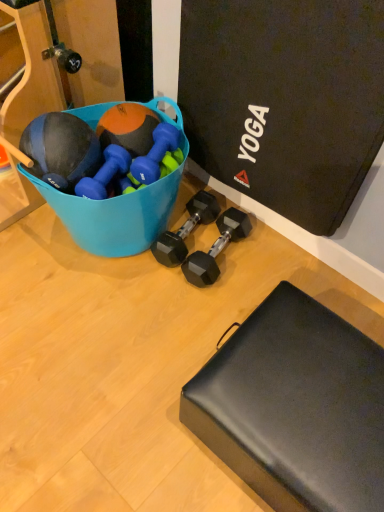
Locate an element on the screen. Image resolution: width=384 pixels, height=512 pixels. free spot above black matte footrest at lower right (from a real-world perspective) is located at coordinates (316, 392).